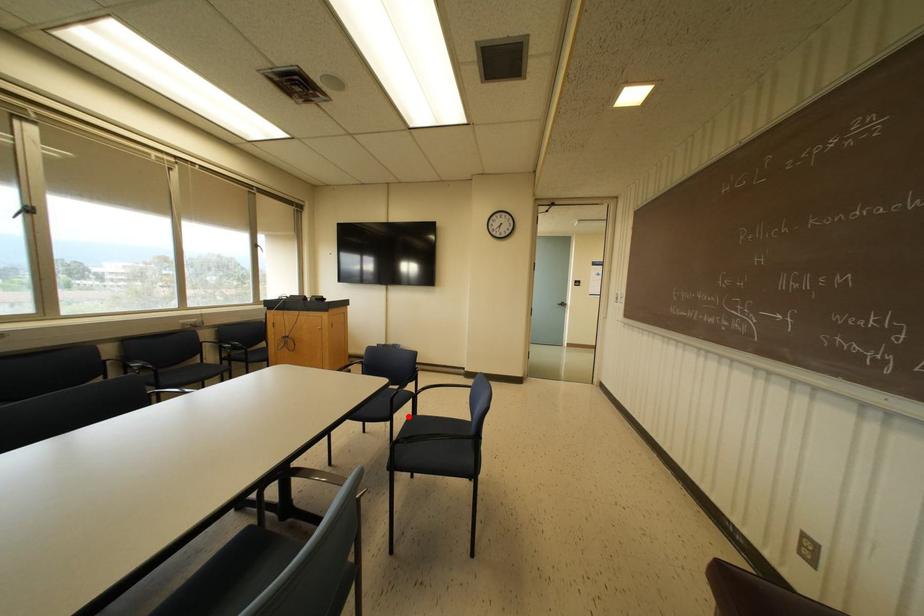
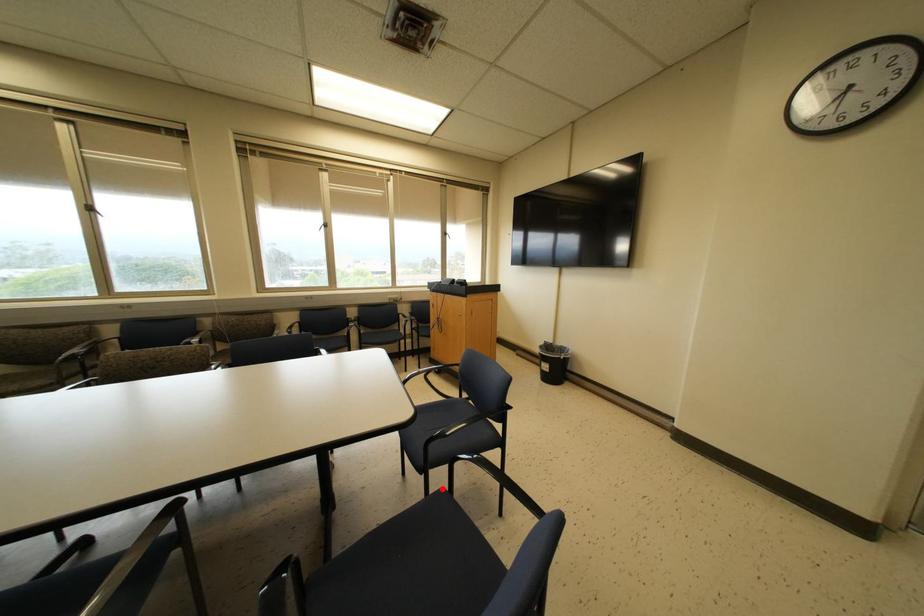
I am providing you with two images of the same scene from different viewpoints. A red point is marked on the first image and another point is marked on the second image. Is the red point in image1 aligned with the point shown in image2?

Yes